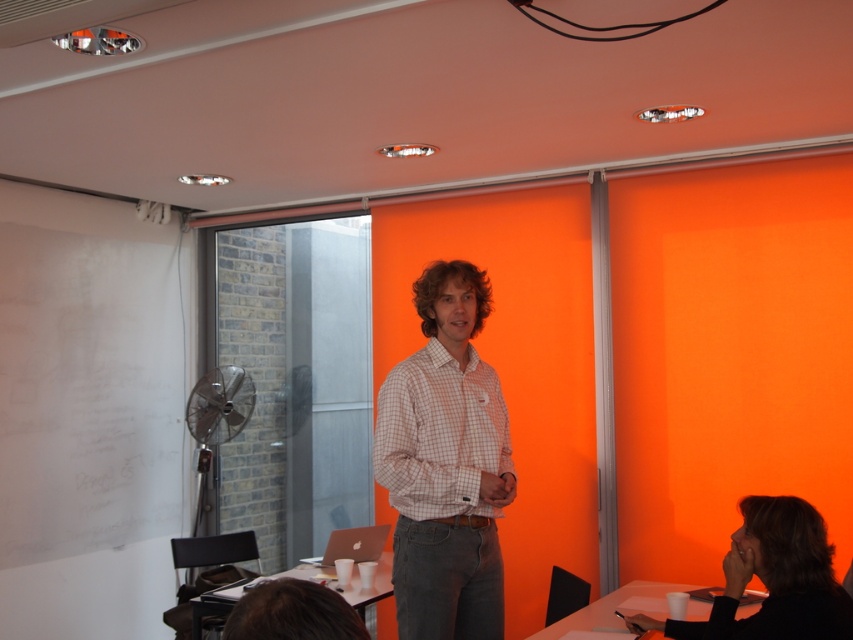
You are standing in the conference room and want to move from point A to point B. Point A is at coordinate point (381, 433) and point B is at coordinate point (775, 632). Since you want to avoid obstacles, which point is closer to you so you can plan your path accordingly?

Point A at coordinate point (381, 433) is closer to you than point B at coordinate point (775, 632), so you should start moving towards point A first to avoid obstacles.

Consider the image. You are standing in the conference room and notice a point at coordinates (x=445, y=465). What object is located at that point?

The checkered fabric shirt at center is located at point (x=445, y=465).

You are a photographer setting up for a group photo in the conference room. You need to position yourself so that both the checkered fabric shirt at center and the black fabric hair at lower right are in focus. Which object should you focus on first to ensure both are sharp?

You should focus on the checkered fabric shirt at center first because it is closer to you than the black fabric hair at lower right. By focusing on the closer object, the farther one will also be in focus due to the depth of field.